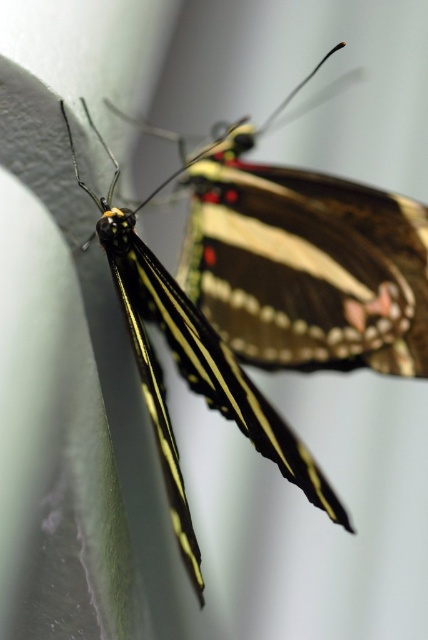
Is point (377, 259) in front of point (160, 419)?

No, (377, 259) is behind (160, 419).

Does shiny brown butterfly at upper center have a greater width compared to shiny black butterfly at center?

Correct, the width of shiny brown butterfly at upper center exceeds that of shiny black butterfly at center.

Which is in front, point (397, 227) or point (220, 378)?

Positioned in front is point (220, 378).

The image size is (428, 640). I want to click on shiny brown butterfly at upper center, so click(306, 262).